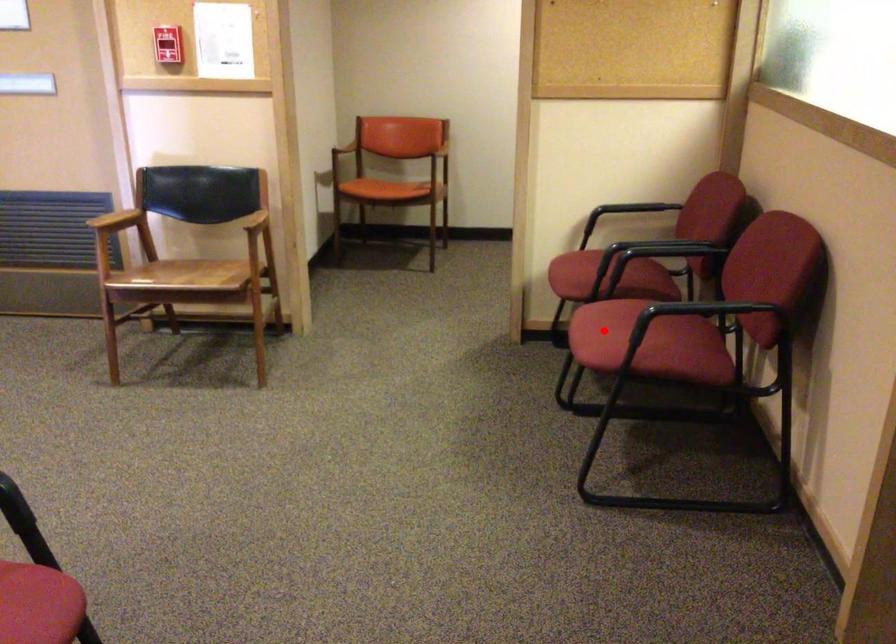
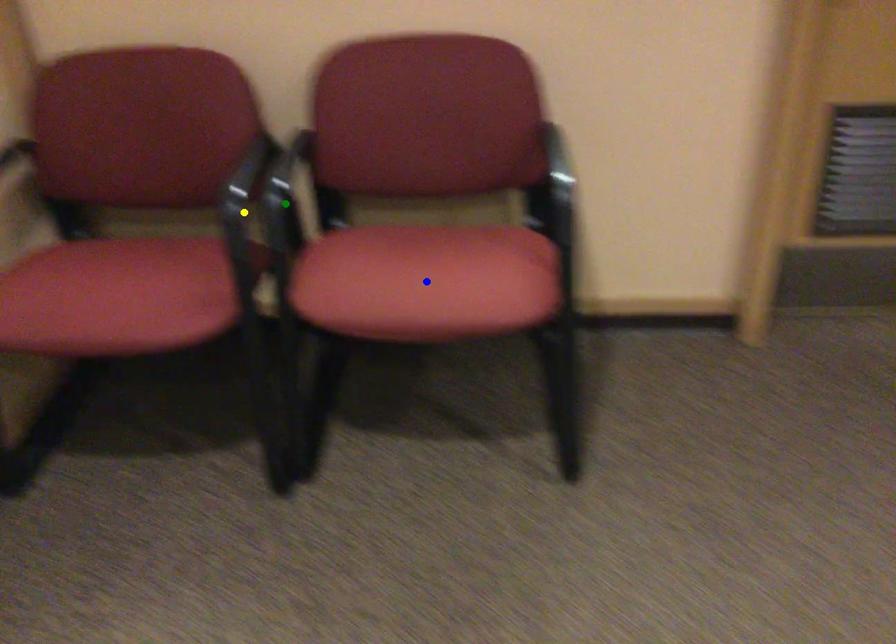
Question: I am providing you with two images of the same scene from different viewpoints. A red point is marked on the first image. You are given multiple points on the second image. Which spot in image 2 lines up with the point in image 1?

Choices:
 (A) green point
 (B) blue point
 (C) yellow point

Answer: (B)